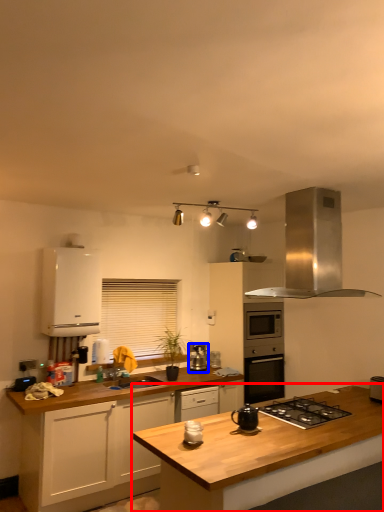
Question: Among these objects, which one is farthest to the camera, countertop (highlighted by a red box) or kitchen appliance (highlighted by a blue box)?

Choices:
 (A) countertop
 (B) kitchen appliance

Answer: (B)